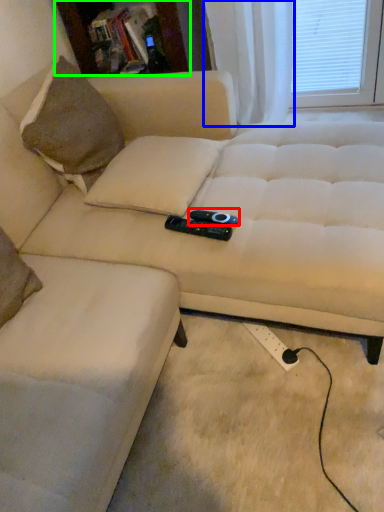
Question: Estimate the real-world distances between objects in this image. Which object is closer to remote (highlighted by a red box), curtain (highlighted by a blue box) or bookshelf (highlighted by a green box)?

Choices:
 (A) curtain
 (B) bookshelf

Answer: (A)